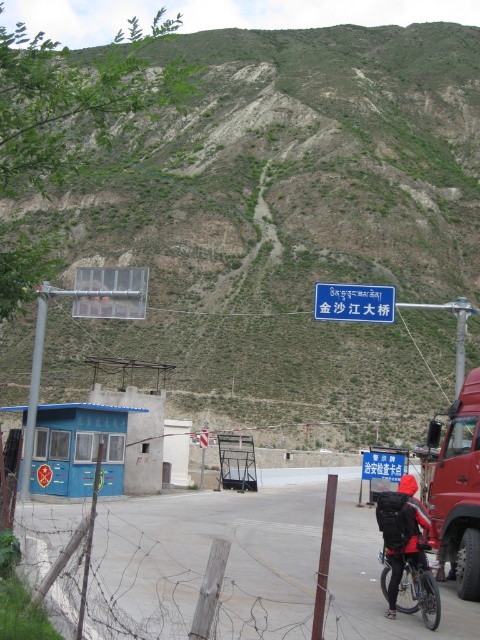
You are a delivery driver who needs to park your red matte truck at right near the silver metallic bicycle at lower center. Based on the scene, can you park the truck in a way that it doesn not block the bicycle?

The red matte truck at right is located below the silver metallic bicycle at lower center, so parking the truck below the bicycle would not block it as they are already positioned that way.

You are a delivery driver who needs to park your red matte truck at right next to the silver metallic bicycle at lower center. Is there enough space for both vehicles to fit side by side?

The red matte truck at right is wider than the silver metallic bicycle at lower center. Since the truck is wider, there may not be enough space for both to fit side by side unless the area is sufficiently wide. However, without knowing the total available space, it is impossible to determine definitively.

You are a delivery driver who needs to park your red matte truck at right near the checkpoint. The parking area is located at point [458,492]. Is your truck currently at the correct parking spot?

The point [458,492] corresponds to the red matte truck at right, so yes, the truck is currently at the correct parking spot.